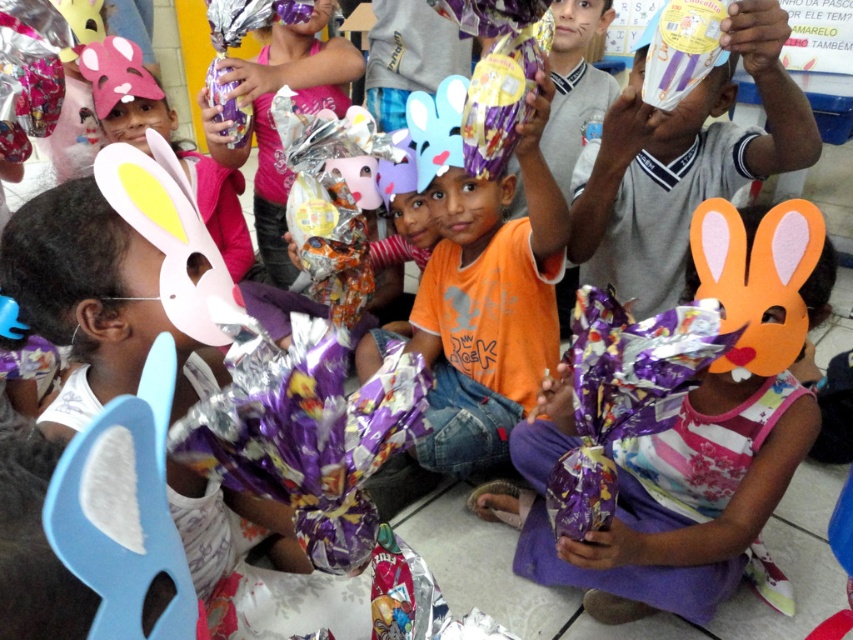
Question: Among these objects, which one is farthest from the camera?

Choices:
 (A) orange felt mask at center
 (B) orange paper mask at upper right
 (C) orange matte shirt at center

Answer: (C)

Question: Is orange matte shirt at center to the right of orange paper mask at upper right from the viewer's perspective?

Choices:
 (A) no
 (B) yes

Answer: (A)

Question: Does orange felt mask at center come in front of orange matte shirt at center?

Choices:
 (A) yes
 (B) no

Answer: (A)

Question: Is orange felt mask at center in front of orange matte shirt at center?

Choices:
 (A) no
 (B) yes

Answer: (B)

Question: Which object appears farthest from the camera in this image?

Choices:
 (A) orange paper mask at upper right
 (B) orange felt mask at center

Answer: (A)

Question: Which object appears closest to the camera in this image?

Choices:
 (A) orange felt mask at center
 (B) orange paper mask at upper right
 (C) orange matte shirt at center

Answer: (A)